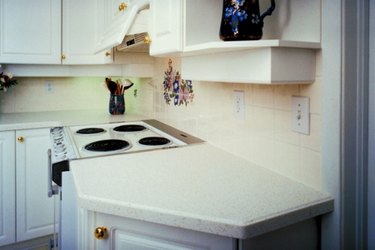
Where is `shelf`? This screenshot has height=250, width=375. shelf is located at coordinates (257, 45).